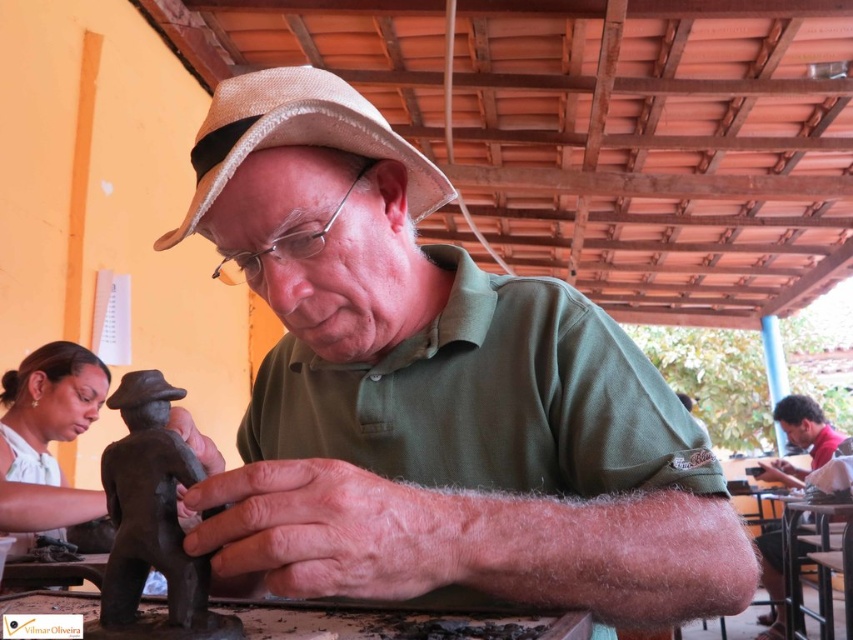
Does point (651, 371) come behind point (9, 369)?

That is False.

How far apart are matte brown clay figure at center and matte brown statue at lower left?

1.09 meters

Who is more forward, (x=699, y=490) or (x=45, y=404)?

Point (x=699, y=490) is more forward.

This screenshot has height=640, width=853. I want to click on matte brown clay figure at center, so click(x=433, y=394).

Does matte brown clay figure at center have a smaller size compared to matte brown figurine at center?

Yes.

Is matte brown clay figure at center bigger than matte brown figurine at center?

Incorrect, matte brown clay figure at center is not larger than matte brown figurine at center.

Describe the element at coordinates (433, 394) in the screenshot. I see `matte brown clay figure at center` at that location.

Image resolution: width=853 pixels, height=640 pixels. Identify the location of matte brown clay figure at center. (433, 394).

Does straw hat at center have a smaller size compared to matte brown statue at lower left?

Yes.

Between straw hat at center and matte brown statue at lower left, which one has more height?

matte brown statue at lower left

Which is in front, point (410, 180) or point (51, 429)?

Point (410, 180) is more forward.

Image resolution: width=853 pixels, height=640 pixels. I want to click on straw hat at center, so click(297, 134).